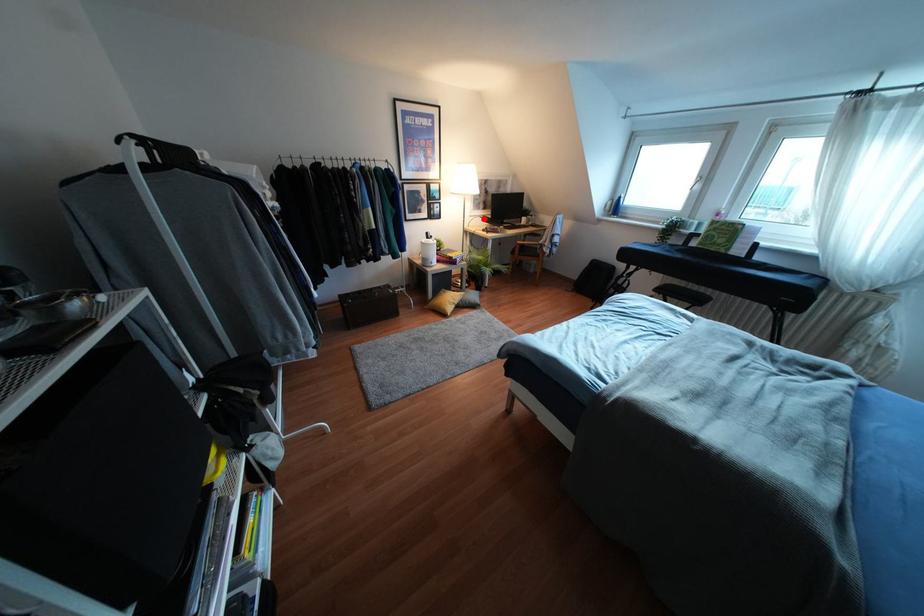
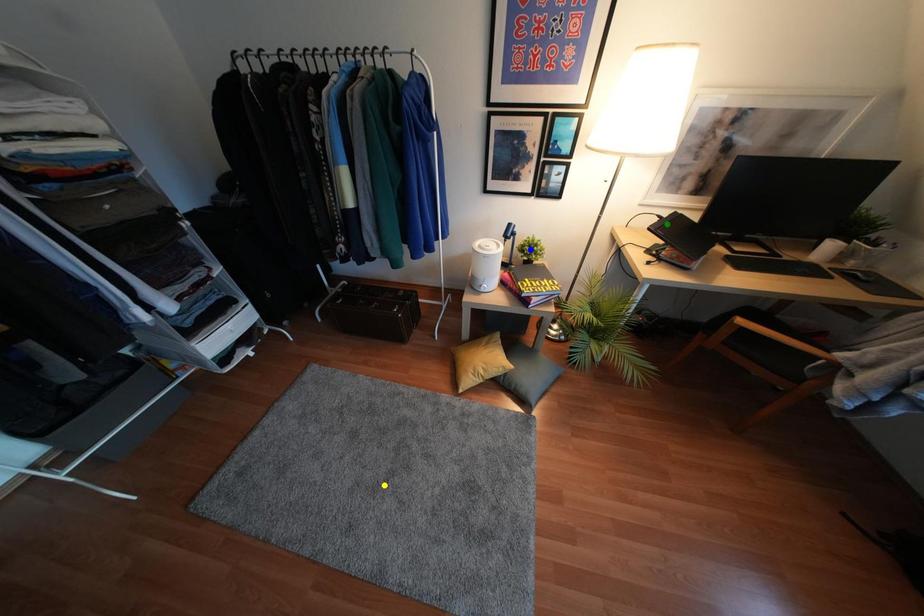
Question: I am providing you with two images of the same scene from different viewpoints. A red point is marked on the first image. You are given multiple points on the second image. Which mark in image 2 goes with the point in image 1?

Choices:
 (A) blue point
 (B) green point
 (C) yellow point

Answer: (B)